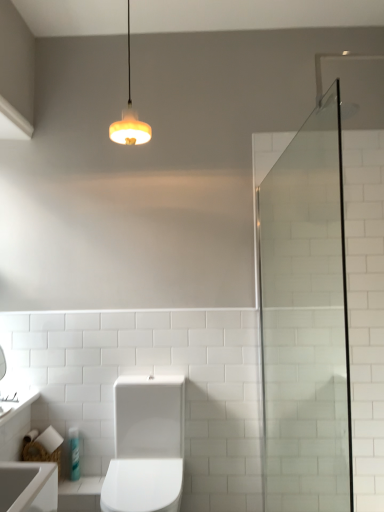
Question: In terms of height, does translucent plastic bottle at lower left look taller or shorter compared to white glossy sink at lower left?

Choices:
 (A) tall
 (B) short

Answer: (A)

Question: From a real-world perspective, is translucent plastic bottle at lower left positioned above or below white glossy sink at lower left?

Choices:
 (A) below
 (B) above

Answer: (A)

Question: Estimate the real-world distances between objects in this image. Which object is farther from the white glossy sink at lower left?

Choices:
 (A) white glossy toilet at center
 (B) matte yellow glass pendant light at upper center
 (C) translucent plastic bottle at lower left
 (D) clear glass shower door at right

Answer: (D)

Question: Which object is the farthest from the white glossy sink at lower left?

Choices:
 (A) matte yellow glass pendant light at upper center
 (B) white glossy toilet at center
 (C) translucent plastic bottle at lower left
 (D) clear glass shower door at right

Answer: (D)